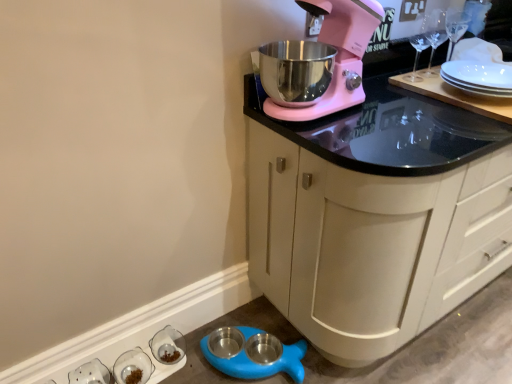
Locate an element on the screen. free space to the back side of clear glass bowls at lower left, the 2th tableware when ordered from left to right is located at coordinates (148, 344).